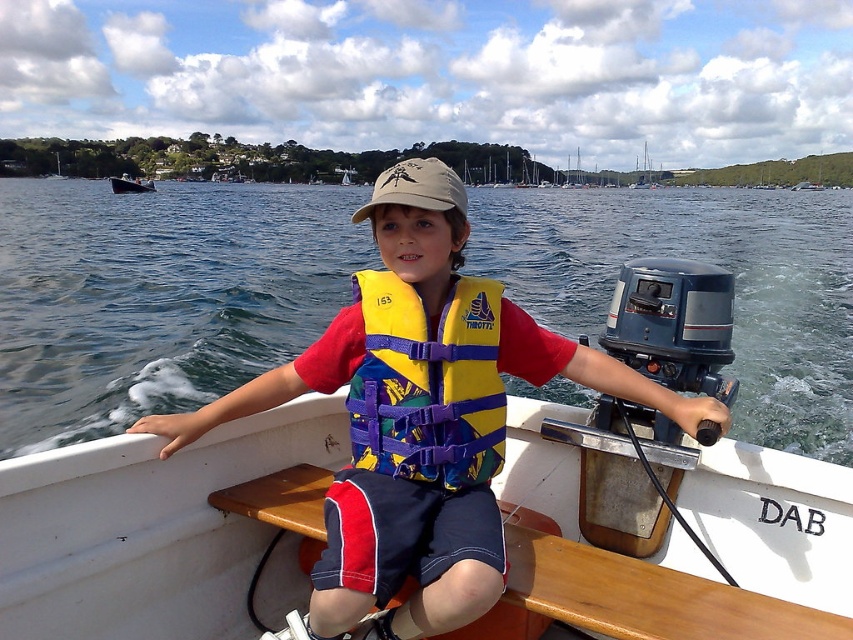
Does blue water at center appear under brushed metal boat at upper left?

Yes, blue water at center is below brushed metal boat at upper left.

This screenshot has width=853, height=640. Describe the element at coordinates (158, 296) in the screenshot. I see `blue water at center` at that location.

Image resolution: width=853 pixels, height=640 pixels. Describe the element at coordinates (158, 296) in the screenshot. I see `blue water at center` at that location.

Identify the location of blue water at center. (158, 296).

Is yellow/purple fabric life vest at center to the right of brushed metal boat at upper left from the viewer's perspective?

Correct, you'll find yellow/purple fabric life vest at center to the right of brushed metal boat at upper left.

Between point (428, 472) and point (144, 182), which one is positioned in front?

Positioned in front is point (428, 472).

Based on the photo, who is more forward, (442, 364) or (144, 189)?

Point (442, 364) is in front.

At what (x,y) coordinates should I click in order to perform the action: click on yellow/purple fabric life vest at center. Please return your answer as a coordinate pair (x, y). Looking at the image, I should click on (428, 384).

Who is more forward, (88, 403) or (502, 438)?

Point (502, 438)

Does point (68, 202) come closer to viewer compared to point (438, 467)?

No.

Find the location of a particular element. The height and width of the screenshot is (640, 853). blue water at center is located at coordinates pos(158,296).